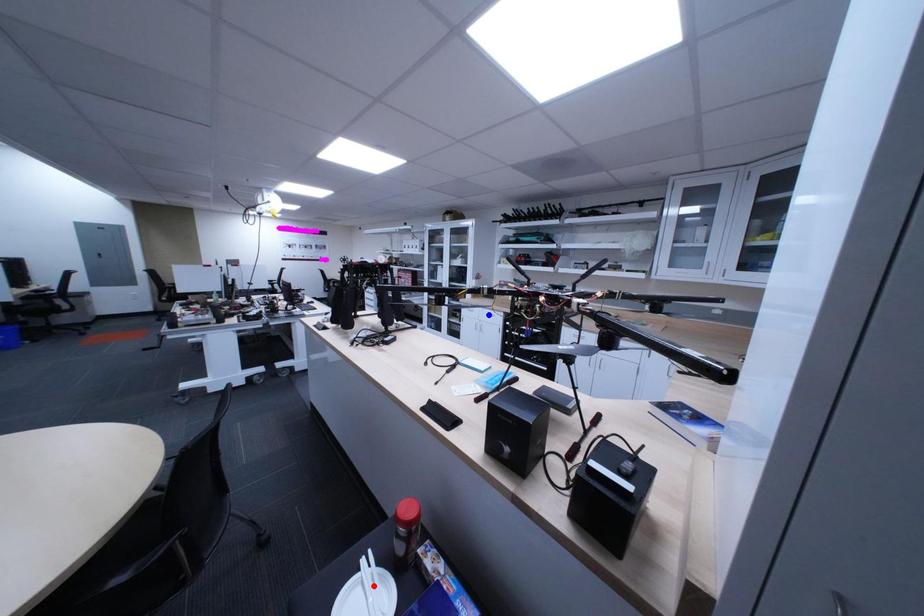
Question: Which of the two points in the image is closer to the camera?

Choices:
 (A) Blue point is closer.
 (B) Red point is closer.

Answer: (B)